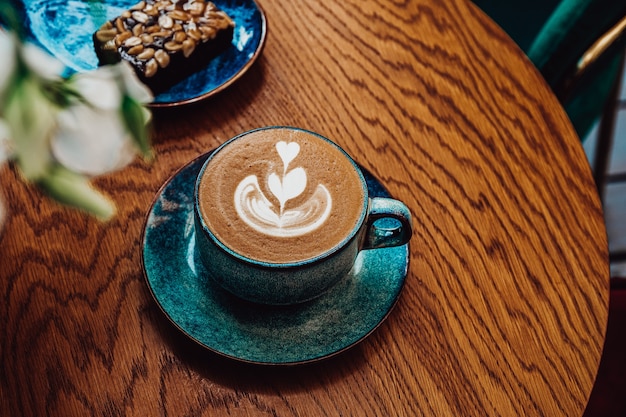
The height and width of the screenshot is (417, 626). I want to click on plate that the latte cup is on, so click(x=245, y=336).